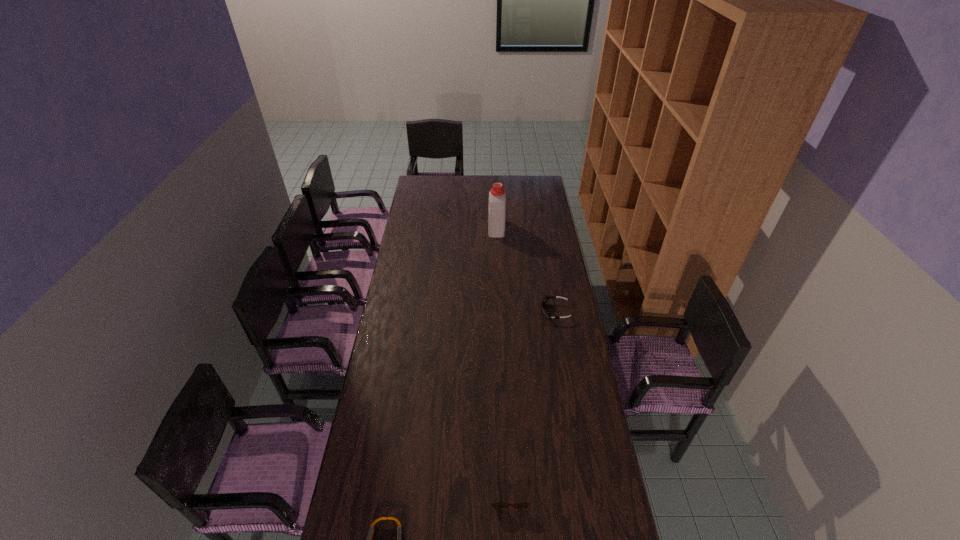
You are a GUI agent. You are given a task and a screenshot of the screen. Output one action in this format:
    pyautogui.click(x=<x>, y=<y>)
    Task: Click on the free region located on the front and sides of the farther goggles
    
    Given the screenshot: What is the action you would take?
    pyautogui.click(x=472, y=312)

You are a GUI agent. You are given a task and a screenshot of the screen. Output one action in this format:
    pyautogui.click(x=<x>, y=<y>)
    Task: Click on the vacant region located at the front view of the spectacles
    The height and width of the screenshot is (540, 960).
    Given the screenshot: What is the action you would take?
    pyautogui.click(x=512, y=538)

The width and height of the screenshot is (960, 540). What are the coordinates of `object at the right edge` in the screenshot? It's located at (545, 299).

The height and width of the screenshot is (540, 960). In the image, there is a desktop. What are the coordinates of `vacant space at the left edge` in the screenshot? It's located at (423, 217).

Locate an element on the screen. The image size is (960, 540). vacant area at the right edge is located at coordinates [x=550, y=374].

Where is `vacant space in between the taller goggles and the farthest object`? This screenshot has height=540, width=960. vacant space in between the taller goggles and the farthest object is located at coordinates 526,270.

At what (x,y) coordinates should I click in order to perform the action: click on free space between the farthest object and the spectacles. Please return your answer as a coordinate pair (x, y). This screenshot has width=960, height=540. Looking at the image, I should click on (503, 360).

I want to click on vacant region between the second nearest object and the right goggles, so click(533, 402).

This screenshot has width=960, height=540. In order to click on empty space that is in between the spectacles and the tallest object in this screenshot , I will do `click(503, 360)`.

I want to click on unoccupied area between the farther goggles and the farthest object, so [x=526, y=270].